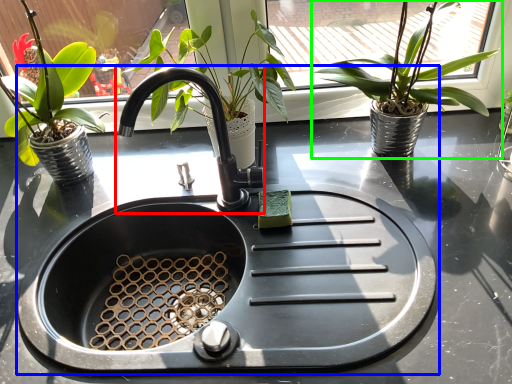
Question: Considering the real-world distances, which object is farthest from tap (highlighted by a red box)? sink (highlighted by a blue box) or houseplant (highlighted by a green box)?

Choices:
 (A) sink
 (B) houseplant

Answer: (B)